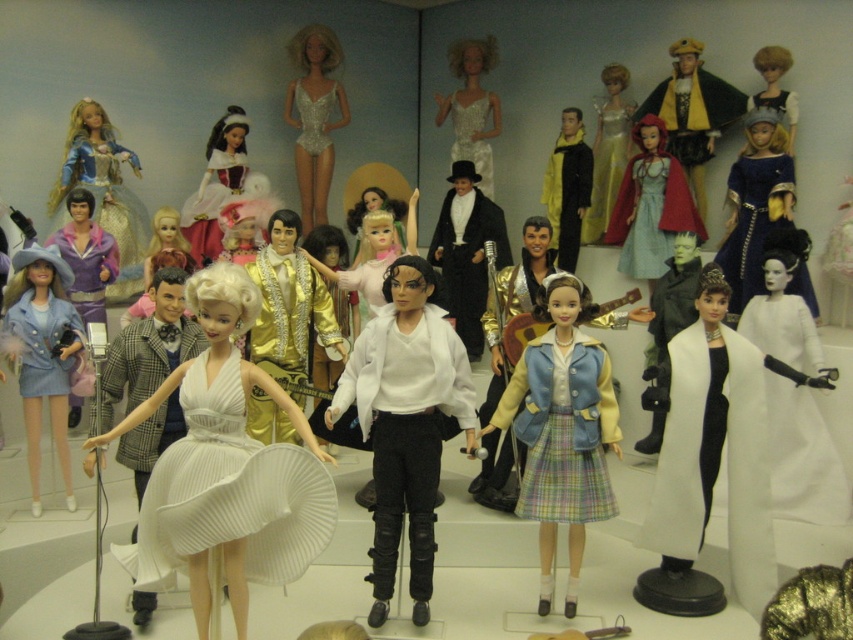
Question: Which point appears farthest from the camera in this image?

Choices:
 (A) (682, 93)
 (B) (780, 410)

Answer: (A)

Question: Can you confirm if white pleated dress at center is wider than matte yellow coat at center?

Choices:
 (A) yes
 (B) no

Answer: (A)

Question: Estimate the real-world distances between objects in this image. Which object is farther from the white pleated dress at center?

Choices:
 (A) shiny silver dress at upper right
 (B) satin sequined bodysuit at center
 (C) shiny silver bodysuit at center
 (D) velvet gold cape at upper right

Answer: (B)

Question: Can you confirm if satin white shirt at center is positioned above white satin dress at center?

Choices:
 (A) no
 (B) yes

Answer: (A)

Question: Is white satin dress at right wider than matte silver dress at upper left?

Choices:
 (A) no
 (B) yes

Answer: (A)

Question: Among these objects, which one is farthest from the camera?

Choices:
 (A) matte silver dress at upper left
 (B) denim jacket at center
 (C) matte red dress at center

Answer: (C)